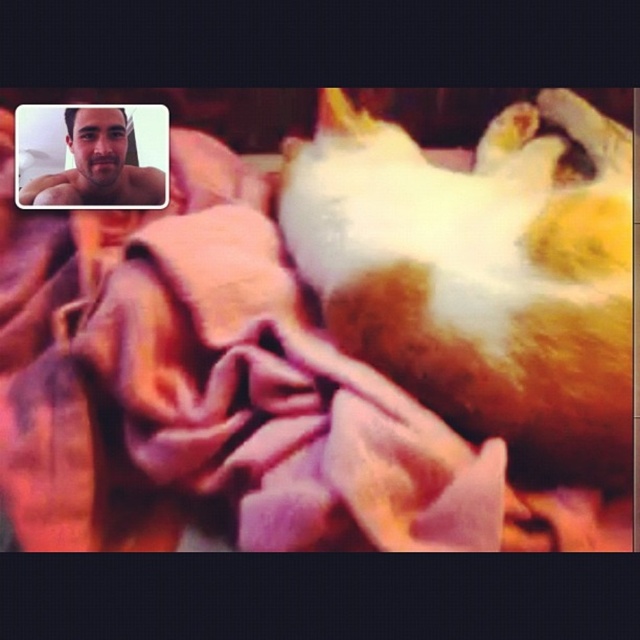
Is fluffy orange cat at center positioned before matte skin at upper left?

Yes, it is.

Does fluffy orange cat at center have a smaller size compared to matte skin at upper left?

Actually, fluffy orange cat at center might be larger than matte skin at upper left.

The width and height of the screenshot is (640, 640). I want to click on fluffy orange cat at center, so pyautogui.click(x=481, y=273).